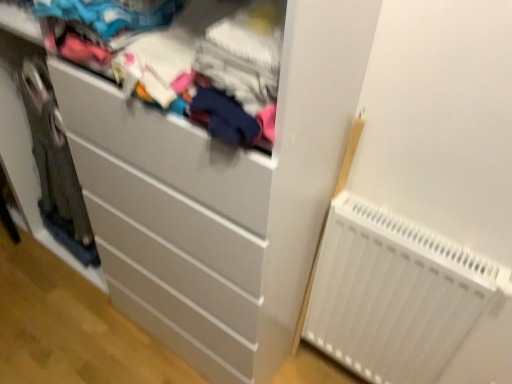
Question: In terms of size, does white matte chest of drawers at center appear bigger or smaller than matte fabric clothes at upper center?

Choices:
 (A) small
 (B) big

Answer: (B)

Question: Considering the positions of white matte chest of drawers at center and matte fabric clothes at upper center in the image, is white matte chest of drawers at center wider or thinner than matte fabric clothes at upper center?

Choices:
 (A) thin
 (B) wide

Answer: (B)

Question: Which of these objects is positioned farthest from the white matte chest of drawers at center?

Choices:
 (A) matte fabric clothes at upper center
 (B) white plastic radiator at lower right

Answer: (B)

Question: Which is farther from the white plastic radiator at lower right?

Choices:
 (A) matte fabric clothes at upper center
 (B) white matte chest of drawers at center

Answer: (A)